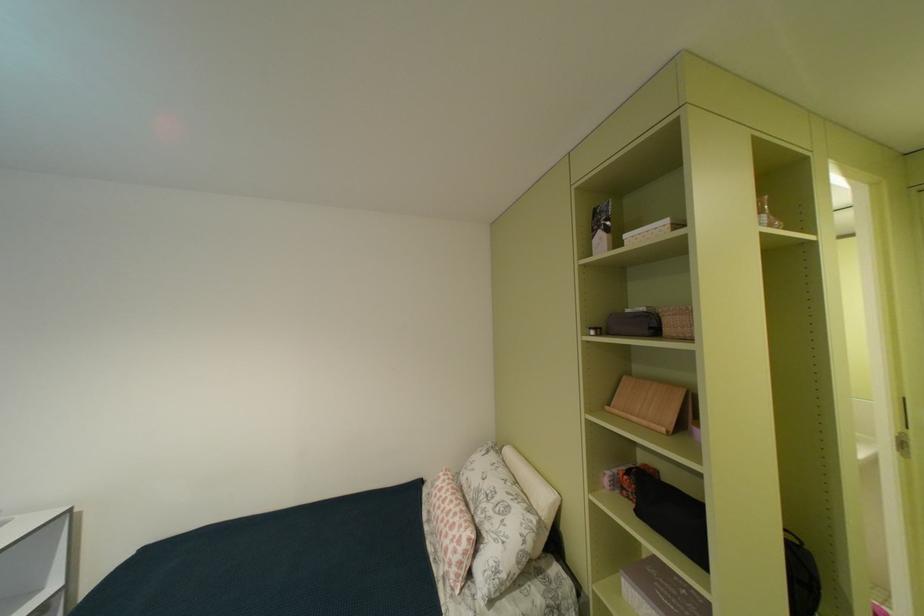
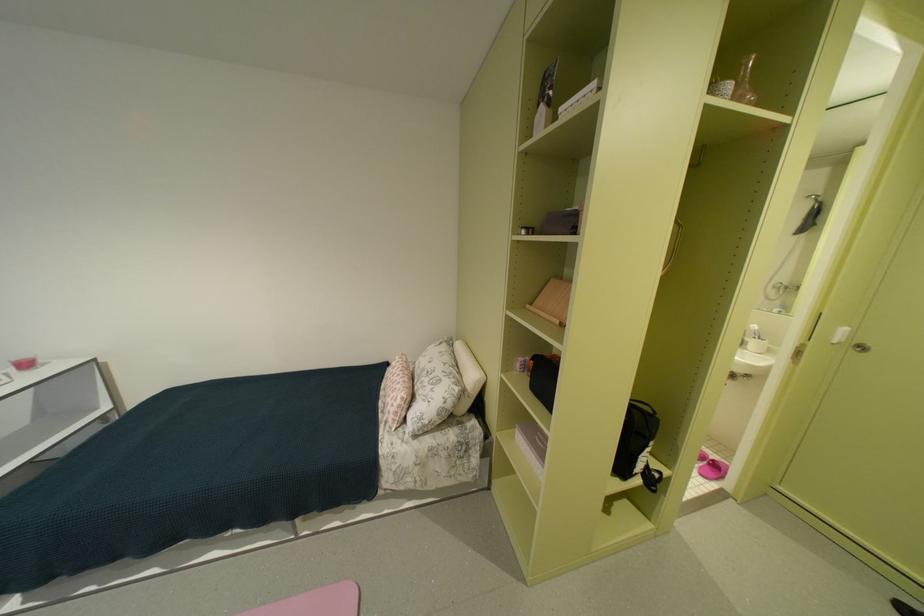
Question: The first image is from the beginning of the video and the second image is from the end. How did the camera likely rotate when shooting the video?

Choices:
 (A) Left
 (B) Right
 (C) Up
 (D) Down

Answer: (D)